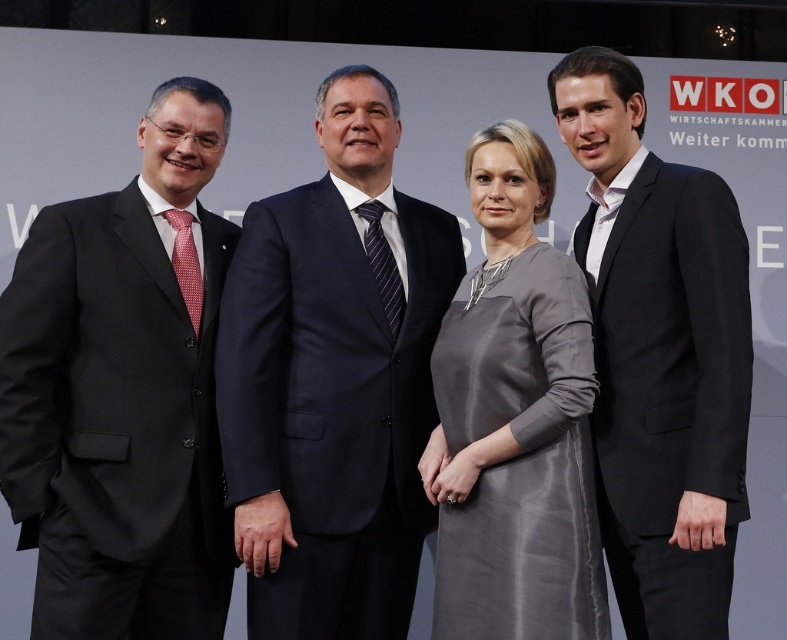
Consider the image. You are standing in front of the group of four people. You need to find the matte black suit at left and the black suit at right. Which one is positioned to the left?

The matte black suit at left is positioned to the left of the black suit at right.

Based on the scene description, which individual is wearing the navy blue suit at center and positioned to the left of the black suit at right?

The navy blue suit at center is the second from left individual, positioned to the left of the black suit at right.

Based on the scene description, which individual is wearing the smaller sized suit between the matte black suit at left and the navy blue suit at center?

The matte black suit at left has a smaller size compared to the navy blue suit at center, so the individual wearing the matte black suit at left is wearing the smaller sized one.